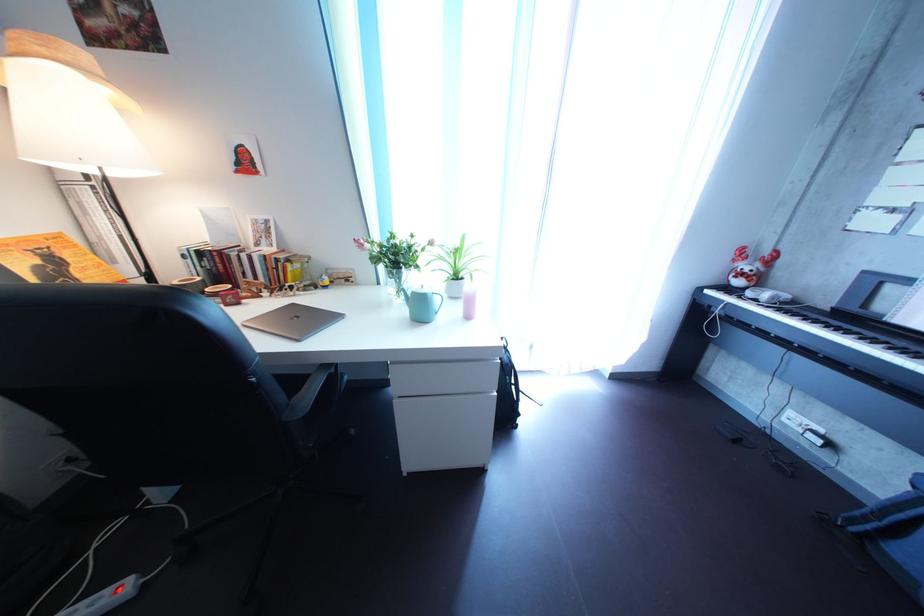
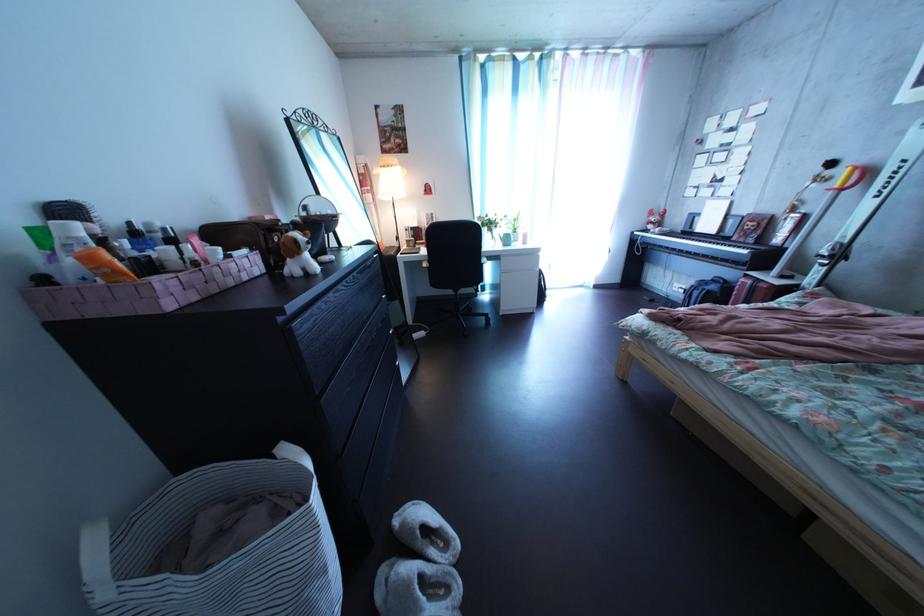
Where in the second image is the point corresponding to [469,285] from the first image?

(529, 240)